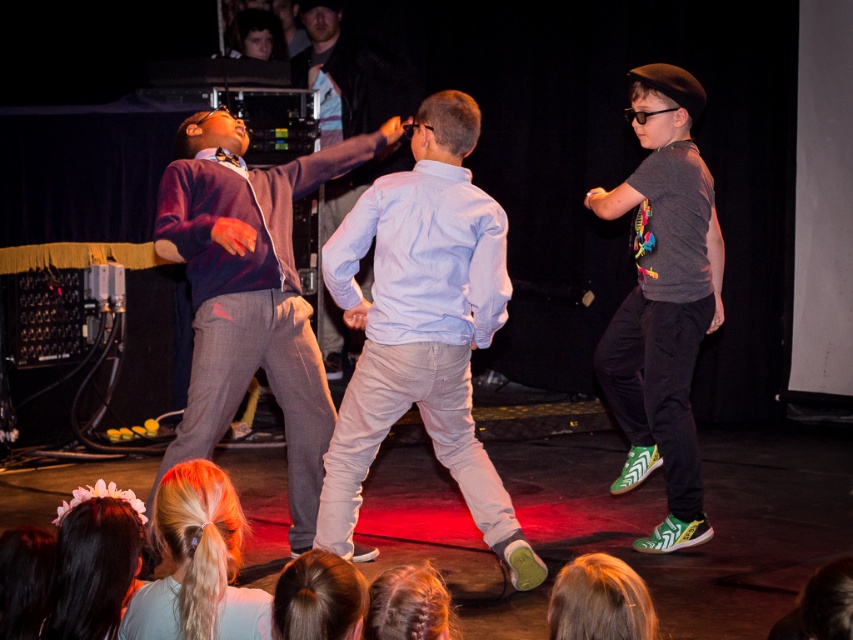
Question: Does dark gray t-shirt at right appear on the left side of blonde braided hair at lower center?

Choices:
 (A) yes
 (B) no

Answer: (B)

Question: Is matte gray suit at center smaller than light blue shirt at center?

Choices:
 (A) yes
 (B) no

Answer: (B)

Question: Is dark gray t-shirt at right closer to camera compared to blonde hair at lower center?

Choices:
 (A) yes
 (B) no

Answer: (B)

Question: Among these points, which one is nearest to the camera?

Choices:
 (A) (527, 556)
 (B) (287, 564)
 (C) (323, 65)

Answer: (B)

Question: Which object is closer to the camera taking this photo?

Choices:
 (A) light blue cotton shirt at center
 (B) blonde braided hair at lower center
 (C) blonde hair at lower center
 (D) blonde hair at lower left

Answer: (C)

Question: Which object is the farthest from the blonde hair at lower center?

Choices:
 (A) blonde hair at lower left
 (B) matte gray suit at center
 (C) blonde braided hair at lower center

Answer: (B)